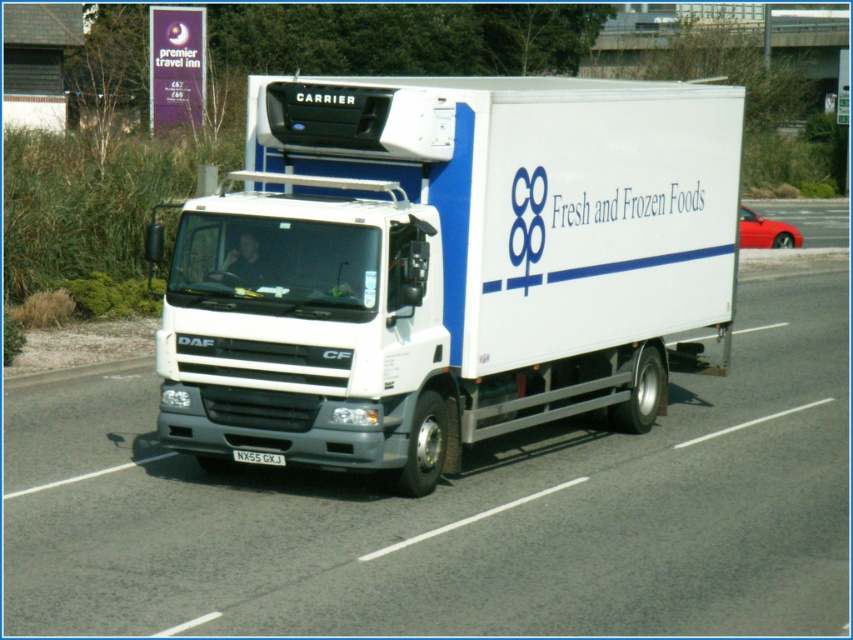
You are a delivery driver who needs to park your truck in a loading zone that can only accommodate vehicles up to the size of the white glossy truck at center. You are currently driving the white matte truck at center. Will your truck fit in the loading zone?

The white matte truck at center has a smaller size compared to the white glossy truck at center. Since the loading zone can accommodate up to the size of the white glossy truck at center, the white matte truck at center will fit in the loading zone.

From the picture: You are a delivery driver who needs to attach a GPS tracker to the white glossy truck at center. The GPS tracker must be placed exactly 2 meters away from the black plastic license plate at center. Can you place the tracker on the truck without exceeding the 2 meter distance?

The white glossy truck at center and black plastic license plate at center are 2.18 meters apart from each other. Since the required distance is 2 meters, the GPS tracker can be placed on the truck within the specified distance as 2.18 meters is slightly more than 2 meters. However, the exact placement would depend on the truck design to ensure it stays within the 2 meter limit.

From the picture: You are a delivery driver who needs to enter a low clearance tunnel. The tunnel has a height limit of 3 meters. You are driving the white matte truck at center which has a black plastic license plate at center. Based on the height of the truck and license plate, can you safely pass through the tunnel?

The white matte truck at center is much taller than the black plastic license plate at center. Since the license plate is mounted on the truck, the overall height of the truck would exceed the license plate, so it may not safely pass through the 3 meter height limit tunnel. However, without exact measurements, it is difficult to determine for certain.